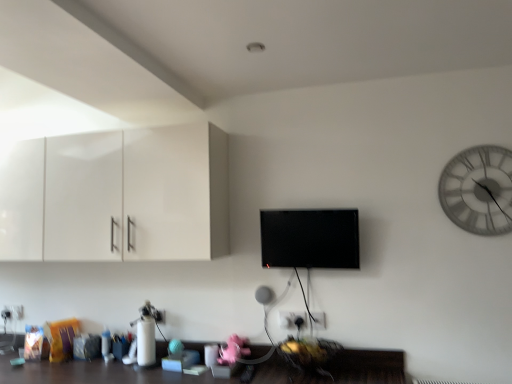
Question: Could white glossy cabinet at upper left be considered to be inside white glass clock at upper right?

Choices:
 (A) yes
 (B) no

Answer: (B)

Question: From the image's perspective, is white glass clock at upper right below white glossy cabinet at upper left?

Choices:
 (A) yes
 (B) no

Answer: (B)

Question: Does white glass clock at upper right have a larger size compared to white glossy cabinet at upper left?

Choices:
 (A) no
 (B) yes

Answer: (A)

Question: Does white glass clock at upper right have a greater width compared to white glossy cabinet at upper left?

Choices:
 (A) yes
 (B) no

Answer: (B)

Question: Can you confirm if white glass clock at upper right is taller than white glossy cabinet at upper left?

Choices:
 (A) yes
 (B) no

Answer: (B)

Question: Considering the relative positions of white plastic electric outlet at lower left, acting as the second electric outlet starting from the top, and white plastic electric outlet at lower center, the first electric outlet when ordered from right to left, in the image provided, is white plastic electric outlet at lower left, acting as the second electric outlet starting from the top, to the left or to the right of white plastic electric outlet at lower center, the first electric outlet when ordered from right to left,?

Choices:
 (A) left
 (B) right

Answer: (A)

Question: Which is correct: white plastic electric outlet at lower left, placed as the 2th electric outlet when sorted from right to left, is inside white plastic electric outlet at lower center, which is counted as the 1th electric outlet, starting from the top, or outside of it?

Choices:
 (A) inside
 (B) outside

Answer: (B)

Question: From a real-world perspective, is white plastic electric outlet at lower left, placed as the 2th electric outlet when sorted from right to left, above or below white plastic electric outlet at lower center, which is counted as the 1th electric outlet, starting from the top?

Choices:
 (A) below
 (B) above

Answer: (A)

Question: Is white plastic electric outlet at lower left, which appears as the first electric outlet when viewed from the left, taller or shorter than white plastic electric outlet at lower center, the first electric outlet when ordered from right to left?

Choices:
 (A) short
 (B) tall

Answer: (B)

Question: From the image's perspective, relative to white glass clock at upper right, is white glossy cabinet at upper left above or below?

Choices:
 (A) above
 (B) below

Answer: (B)

Question: Is point (34, 233) positioned closer to the camera than point (500, 168)?

Choices:
 (A) closer
 (B) farther

Answer: (B)

Question: Looking at their shapes, would you say white glossy cabinet at upper left is wider or thinner than white glass clock at upper right?

Choices:
 (A) thin
 (B) wide

Answer: (B)

Question: Considering their positions, is white glossy cabinet at upper left located in front of or behind white glass clock at upper right?

Choices:
 (A) front
 (B) behind

Answer: (B)

Question: Based on their sizes in the image, would you say white plastic electric outlet at lower center, placed as the second electric outlet when sorted from back to front, is bigger or smaller than black glossy flat screen tv at center?

Choices:
 (A) small
 (B) big

Answer: (A)

Question: Is white plastic electric outlet at lower center, the 2th electric outlet ordered from the bottom, to the left or to the right of black glossy flat screen tv at center in the image?

Choices:
 (A) right
 (B) left

Answer: (A)